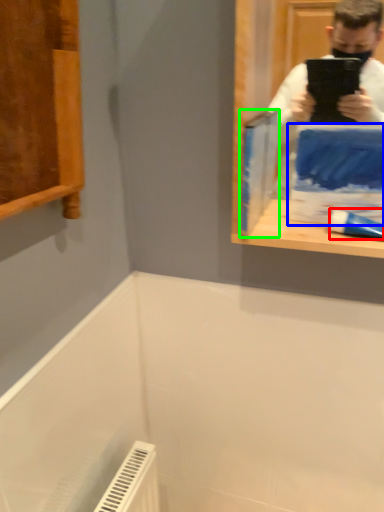
Question: Which object is positioned closest to toothpaste (highlighted by a red box)? Select from paperback book (highlighted by a blue box) and paperback book (highlighted by a green box).

Choices:
 (A) paperback book
 (B) paperback book

Answer: (A)